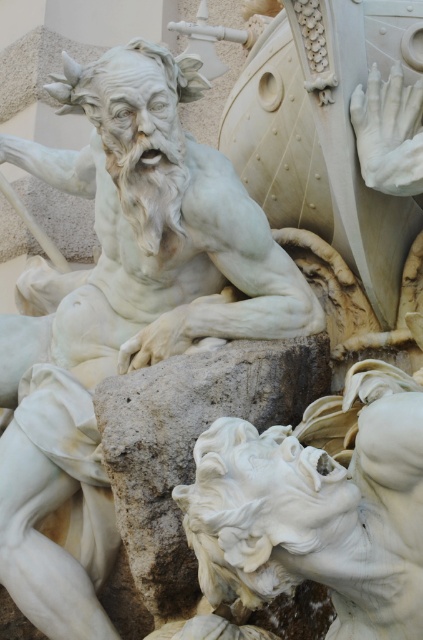
You are an art conservator examining the marble sculpture. You notice a specific point at coordinates point (123,312). Based on the description, can you determine which part of the sculpture this point corresponds to?

The point (123,312) is on the white marble statue at center.

You are an art conservator examining the marble sculpture. You notice two points of concern on the sculpture, labeled as point 1 at coordinates point [57,564] and point 2 at coordinates point [107,420]. Which point is closer to you?

Point [57,564] is further to the viewer than point [107,420], so point [107,420] is closer to you.